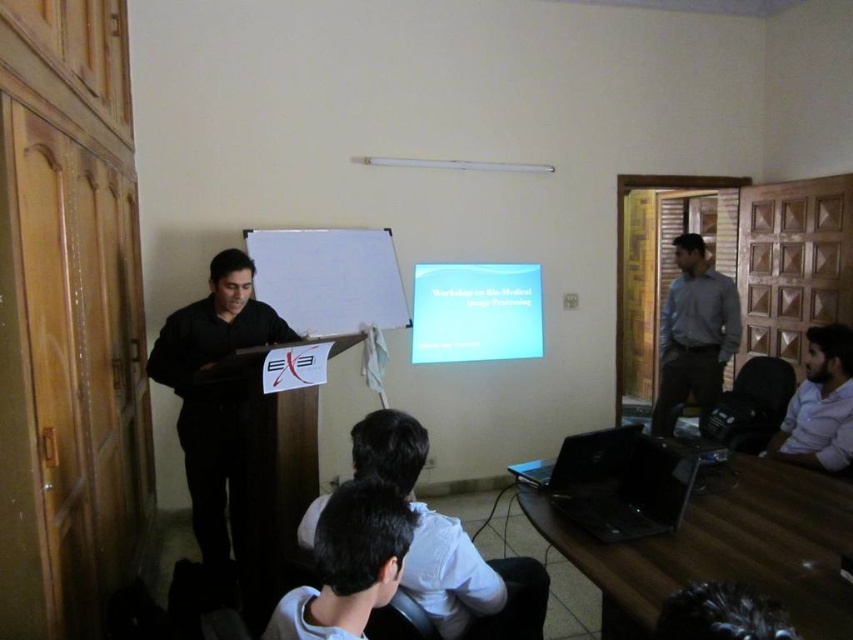
This screenshot has height=640, width=853. Describe the element at coordinates (216, 401) in the screenshot. I see `black matte laptop at center` at that location.

Can you confirm if black matte laptop at center is positioned to the right of black matte laptop at lower center?

In fact, black matte laptop at center is to the left of black matte laptop at lower center.

Is point (247, 556) farther from camera compared to point (633, 436)?

That is True.

The width and height of the screenshot is (853, 640). Identify the location of black matte laptop at center. (216, 401).

Between gray cotton shirt at right and white shirt at lower right, which one appears on the left side from the viewer's perspective?

From the viewer's perspective, white shirt at lower right appears more on the left side.

Who is higher up, gray cotton shirt at right or white shirt at lower right?

Positioned higher is gray cotton shirt at right.

Image resolution: width=853 pixels, height=640 pixels. In order to click on gray cotton shirt at right in this screenshot , I will do `click(694, 333)`.

Does black plastic laptop at lower right have a greater height compared to black matte laptop at lower center?

Yes.

Looking at this image, is black plastic laptop at lower right closer to camera compared to black matte laptop at lower center?

Yes, it is in front of black matte laptop at lower center.

You are a GUI agent. You are given a task and a screenshot of the screen. Output one action in this format:
    pyautogui.click(x=<x>, y=<y>)
    Task: Click on the black plastic laptop at lower right
    This screenshot has height=640, width=853.
    Given the screenshot: What is the action you would take?
    pyautogui.click(x=635, y=496)

Locate an element on the screen. black plastic laptop at lower right is located at coordinates (635, 496).